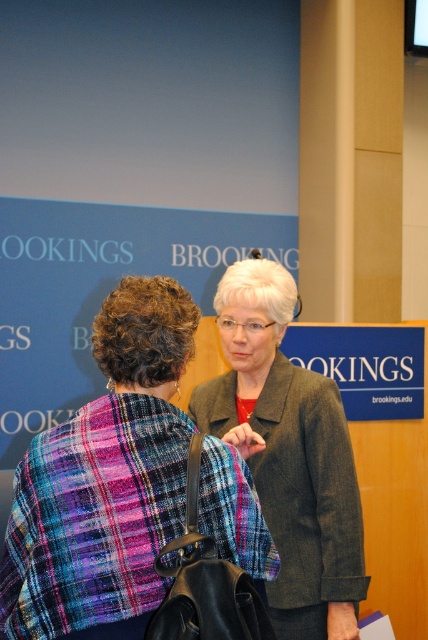
You are organizing a photo shoot and need to ensure that the plaid fabric shawl at center and the matte brown blazer at center can fit side by side on a mannequin. Based on the image, can you determine if there is enough space for both items without overlapping?

The plaid fabric shawl at center might be wider than matte brown blazer at center, so there may not be enough space to place them side by side without overlapping.

You are at a formal event and need to identify clothing items. Which item is positioned higher on the person wearing both the plaid fabric shawl at center and the matte brown blazer at center?

The plaid fabric shawl at center is positioned higher than the matte brown blazer at center.